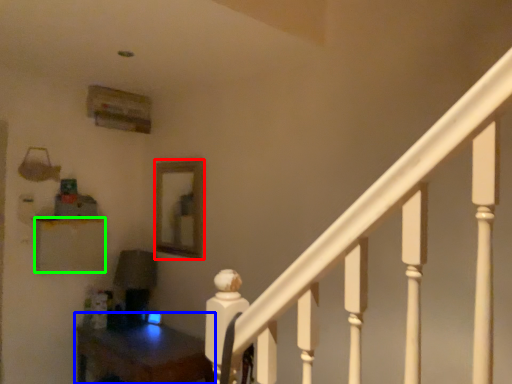
Question: Which object is positioned farthest from mirror (highlighted by a red box)? Select from table (highlighted by a blue box) and furniture (highlighted by a green box).

Choices:
 (A) table
 (B) furniture

Answer: (A)